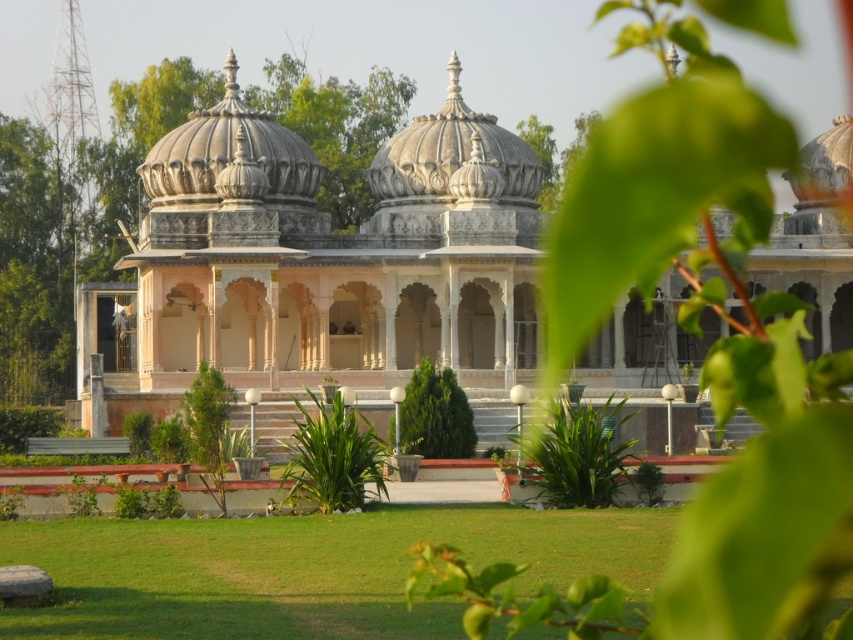
You are a visitor standing at the entrance of the garden facing the building. You notice the white stone dome at center and the green leafy tree at center. Which object is closer to you?

The white stone dome at center is closer to you because the green leafy tree at center is behind it.

You are a landscape architect designing a new garden layout. You need to place a new statue that is 3 meters wide between the white marble palace at center and the green leafy tree at center. Based on the scene description, will the statue fit between them?

The white marble palace at center is wider than the green leafy tree at center. However, the exact distance between them isn

You are a gardener planning to water the green leafy tree at center and the white marble palace at center. Since you can only reach up to 1.8 meters, can you water both objects without using a ladder?

The white marble palace at center is located above the green leafy tree at center. Since the palace is higher, you might not be able to reach it without a ladder, but the tree at center is lower and within your reach. However, the white marble palace at center is a structure and doesn not require watering. Therefore, you can water the green leafy tree at center without a ladder, but the palace doesn not need watering.